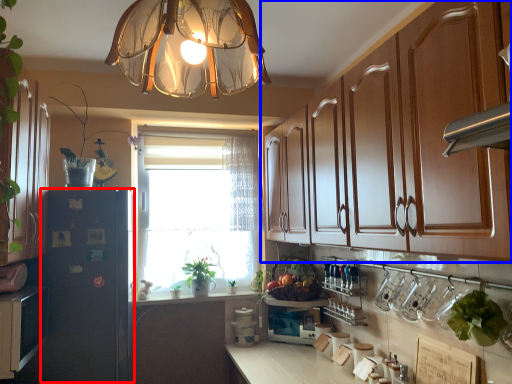
Question: Among these objects, which one is nearest to the camera, fridge (highlighted by a red box) or cabinetry (highlighted by a blue box)?

Choices:
 (A) fridge
 (B) cabinetry

Answer: (B)